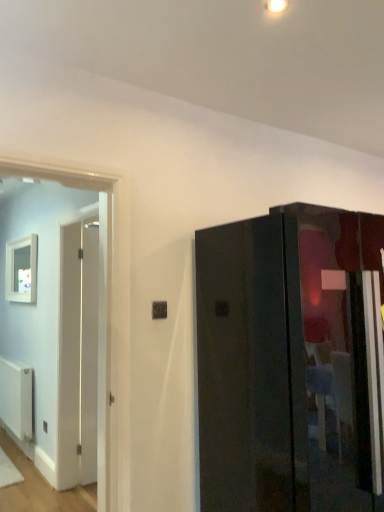
Question: Could you tell me if white matte picture frame at left is turned towards black plastic electric outlet at center?

Choices:
 (A) no
 (B) yes

Answer: (A)

Question: Does white matte picture frame at left appear on the right side of black plastic electric outlet at center?

Choices:
 (A) no
 (B) yes

Answer: (A)

Question: From the image's perspective, is white matte picture frame at left located beneath black plastic electric outlet at center?

Choices:
 (A) no
 (B) yes

Answer: (A)

Question: Does white matte picture frame at left have a lesser height compared to black plastic electric outlet at center?

Choices:
 (A) no
 (B) yes

Answer: (A)

Question: Does white matte picture frame at left have a smaller size compared to black plastic electric outlet at center?

Choices:
 (A) no
 (B) yes

Answer: (A)

Question: Is white matte picture frame at left positioned behind black plastic electric outlet at center?

Choices:
 (A) yes
 (B) no

Answer: (A)

Question: Is white matte radiator at lower left not inside black plastic electric outlet at center?

Choices:
 (A) yes
 (B) no

Answer: (A)

Question: Does white matte radiator at lower left appear on the left side of black plastic electric outlet at center?

Choices:
 (A) yes
 (B) no

Answer: (A)

Question: Is white matte radiator at lower left looking in the opposite direction of black plastic electric outlet at center?

Choices:
 (A) yes
 (B) no

Answer: (B)

Question: Can you confirm if white matte radiator at lower left is taller than black plastic electric outlet at center?

Choices:
 (A) yes
 (B) no

Answer: (A)

Question: Is white matte radiator at lower left at the right side of black plastic electric outlet at center?

Choices:
 (A) no
 (B) yes

Answer: (A)

Question: Could you tell me if white matte radiator at lower left is facing black plastic electric outlet at center?

Choices:
 (A) yes
 (B) no

Answer: (B)

Question: Is glossy black cabinet at right a part of white matte picture frame at left?

Choices:
 (A) no
 (B) yes

Answer: (A)